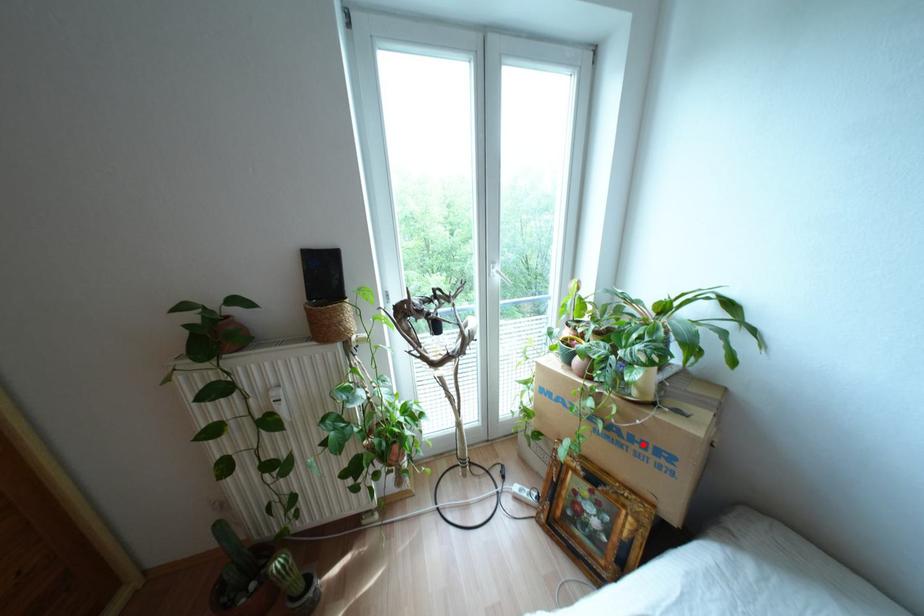
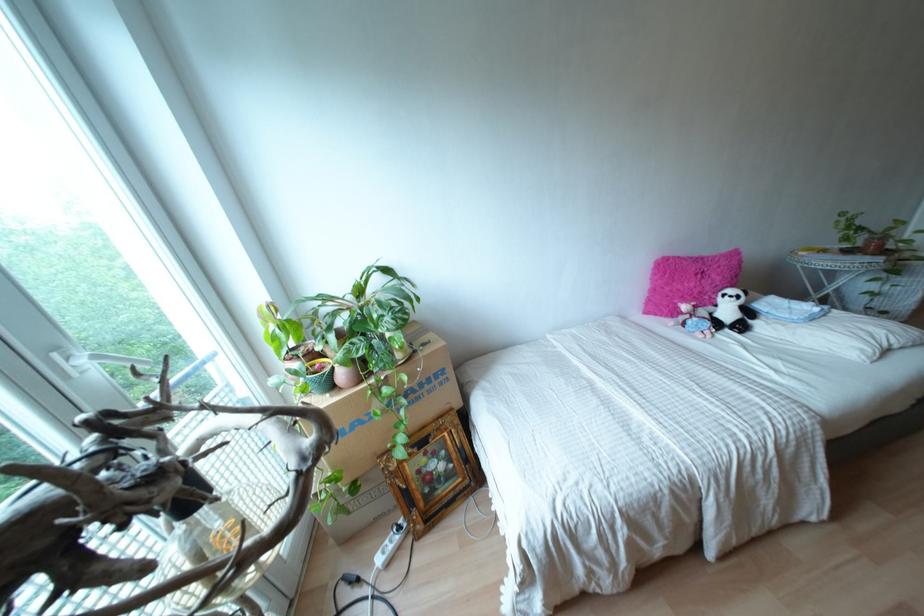
Find the pixel in the second image that matches the highlighted location in the first image.

(428, 379)